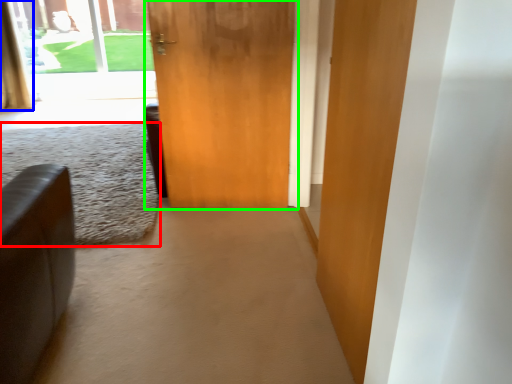
Question: Which object is the farthest from plain (highlighted by a red box)? Choose among these: curtain (highlighted by a blue box) or door (highlighted by a green box).

Choices:
 (A) curtain
 (B) door

Answer: (A)